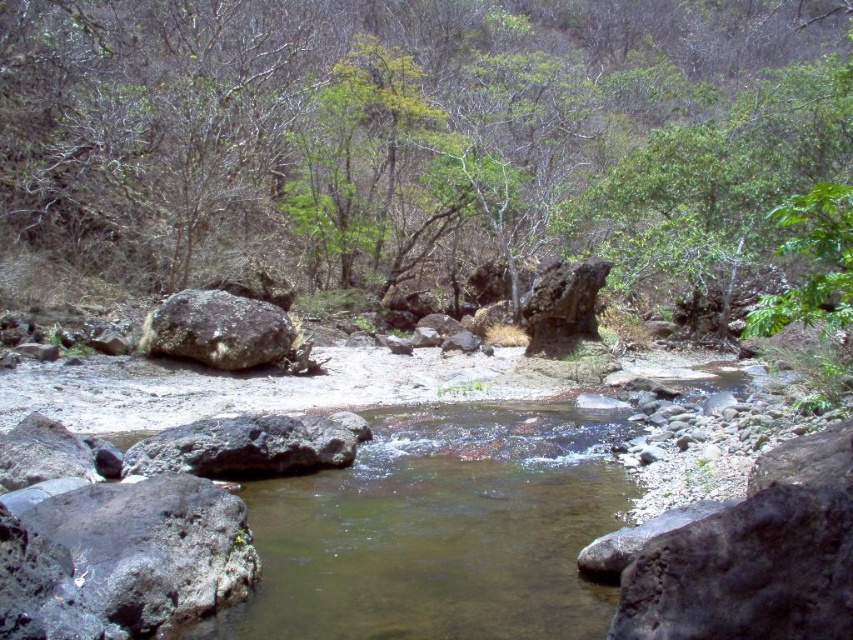
You are standing at the origin point of the coordinate system in this scene. You want to place a new decorative stone at the same position as the gray rough rock at lower left. What coordinates should you use to place it?

The gray rough rock at lower left is located at coordinates point (122, 557). So you should place the new decorative stone at coordinates point (122, 557).

You are standing at point (245, 445) in the image. What object is located exactly at this point?

The dark gray rock at center is located exactly at point (245, 445).